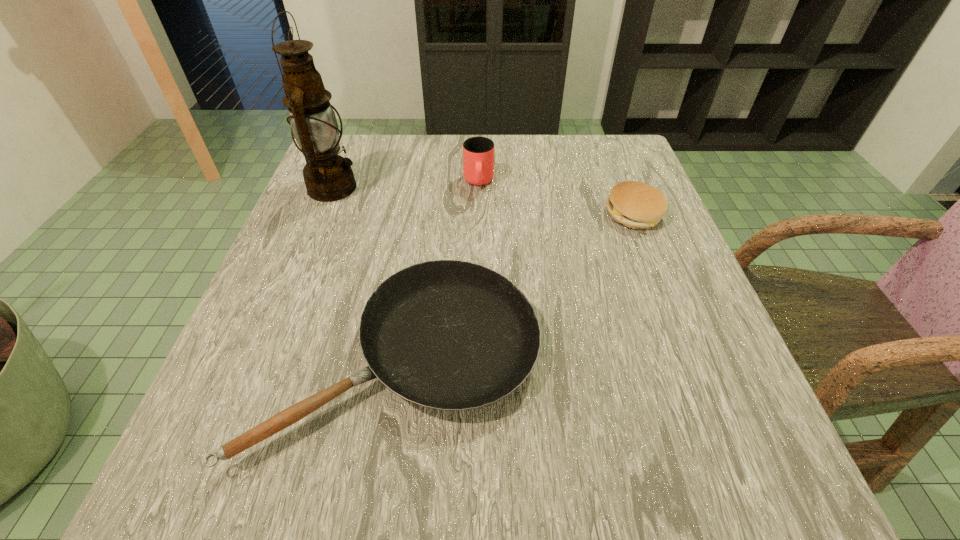
Image resolution: width=960 pixels, height=540 pixels. What are the coordinates of `oil lamp that is at the far edge` in the screenshot? It's located at (328, 176).

Find the location of a particular element. This screenshot has height=540, width=960. cup at the far edge is located at coordinates (478, 152).

Image resolution: width=960 pixels, height=540 pixels. What are the coordinates of `object located at the near edge` in the screenshot? It's located at (452, 335).

At what (x,y) coordinates should I click in order to perform the action: click on oil lamp that is at the left edge. Please return your answer as a coordinate pair (x, y). The width and height of the screenshot is (960, 540). Looking at the image, I should click on (328, 176).

What are the coordinates of `frying pan at the left edge` in the screenshot? It's located at tap(452, 335).

You are a GUI agent. You are given a task and a screenshot of the screen. Output one action in this format:
    pyautogui.click(x=<x>, y=<y>)
    Task: Click on the object that is positioned at the right edge
    
    Given the screenshot: What is the action you would take?
    pyautogui.click(x=635, y=204)

The width and height of the screenshot is (960, 540). What are the coordinates of `object present at the far left corner` in the screenshot? It's located at (328, 176).

I want to click on object that is at the near left corner, so click(452, 335).

At what (x,y) coordinates should I click in order to perform the action: click on vacant space at the far edge. Please return your answer as a coordinate pair (x, y). Image resolution: width=960 pixels, height=540 pixels. Looking at the image, I should click on (546, 189).

Locate an element on the screen. The width and height of the screenshot is (960, 540). vacant space at the near edge of the desktop is located at coordinates (532, 490).